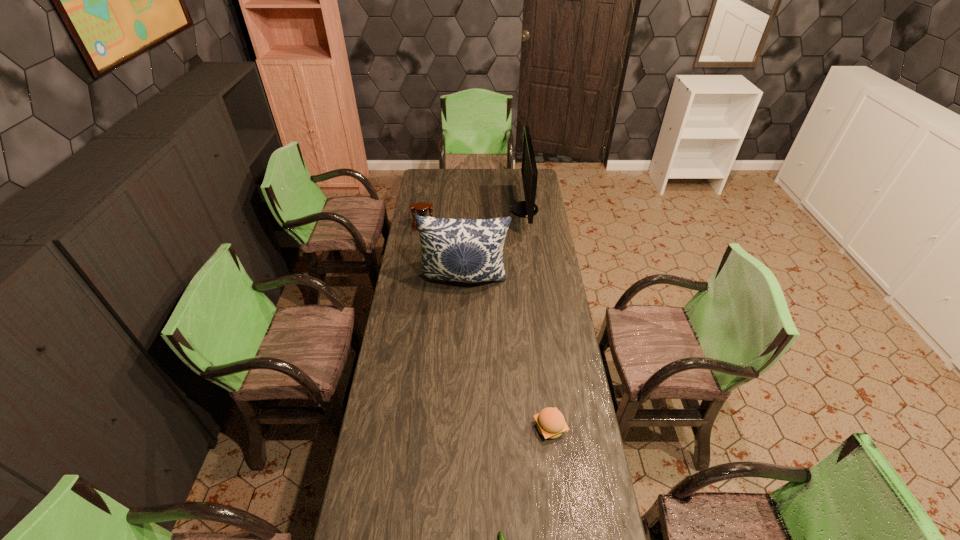
You are a GUI agent. You are given a task and a screenshot of the screen. Output one action in this format:
    pyautogui.click(x=<x>, y=<y>)
    Task: Click on the free space between the computer monitor and the third shortest object
    The width and height of the screenshot is (960, 540).
    Given the screenshot: What is the action you would take?
    pyautogui.click(x=474, y=219)

Locate an element on the screen. Image resolution: width=960 pixels, height=540 pixels. vacant space that is in between the computer monitor and the third shortest object is located at coordinates (474, 219).

I want to click on object identified as the closest to the second nearest object, so click(x=502, y=539).

Locate which object ranks second in proximity to the computer monitor. Please provide its 2D coordinates. Your answer should be formatted as a tuple, i.e. [(x, y)], where the tuple contains the x and y coordinates of a point satisfying the conditions above.

[(421, 208)]

The image size is (960, 540). I want to click on blank space that satisfies the following two spatial constraints: 1. on the front-facing side of the computer monitor; 2. on the front surface of the third farthest object, so click(x=534, y=279).